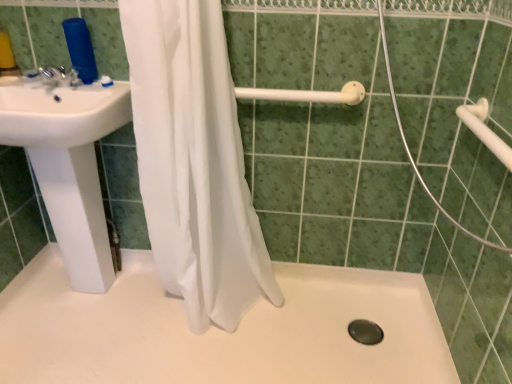
The height and width of the screenshot is (384, 512). In order to click on vacant space that is to the left of black rubber drain at bottom center in this screenshot , I will do `click(317, 331)`.